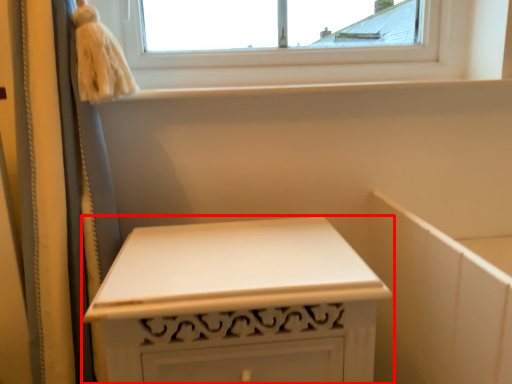
Question: In this image, where is furniture (annotated by the red box) located relative to window sill?

Choices:
 (A) right
 (B) left

Answer: (B)